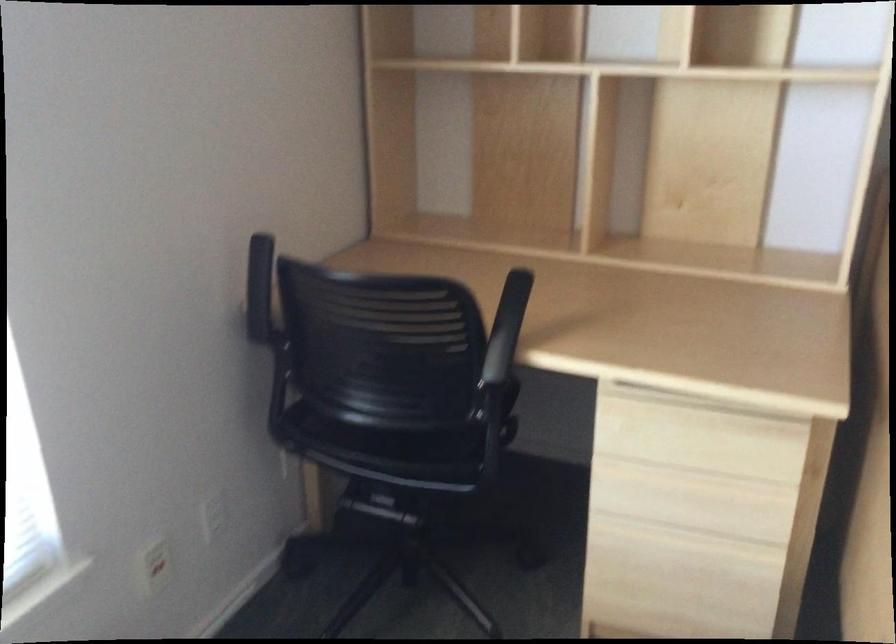
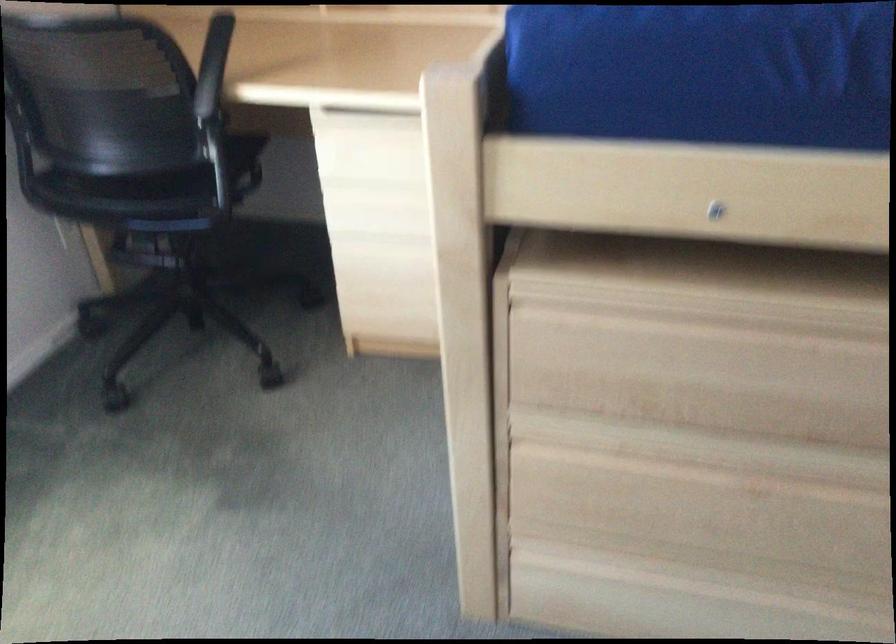
Question: Based on the continuous images, in which direction is the camera rotating? Reply with the corresponding letter.

Choices:
 (A) Left
 (B) Right
 (C) Up
 (D) Down

Answer: (D)